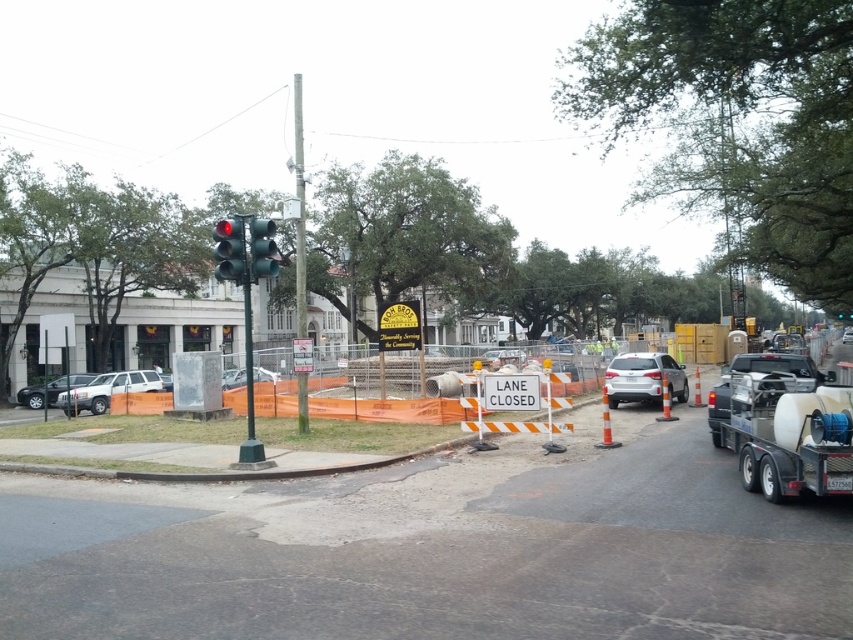
Question: Where is silver metallic sedan at left located in relation to metallic silver sedan at center in the image?

Choices:
 (A) right
 (B) left

Answer: (B)

Question: Which point is closer to the camera?

Choices:
 (A) (486, 349)
 (B) (648, 394)
 (C) (215, 275)
 (D) (74, 384)

Answer: (B)

Question: Which object is closer to the camera taking this photo?

Choices:
 (A) orange plastic barrier at center
 (B) green matte traffic light at upper left

Answer: (A)

Question: Which of the following is the farthest from the observer?

Choices:
 (A) gold metallic sign at center
 (B) matte black traffic light at upper left
 (C) metallic silver sedan at center
 (D) orange plastic barrier at center

Answer: (C)

Question: Is matte black traffic light at upper left wider than satin silver sedan at center?

Choices:
 (A) no
 (B) yes

Answer: (A)

Question: Does satin silver suv at center have a greater width compared to silver metallic sedan at left?

Choices:
 (A) no
 (B) yes

Answer: (A)